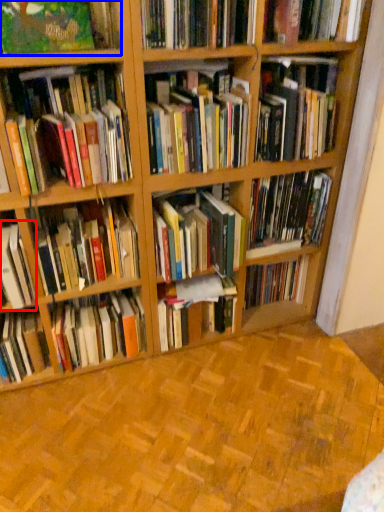
Question: Which of the following is the farthest to the observer, book (highlighted by a red box) or book (highlighted by a blue box)?

Choices:
 (A) book
 (B) book

Answer: (A)